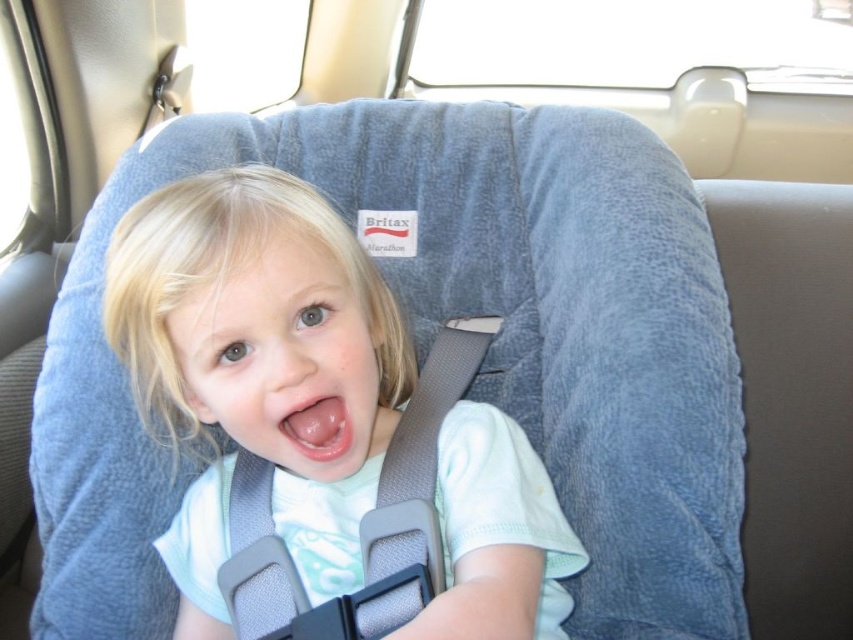
Does matte gray car seat at center appear over pink glossy tongue at center?

Result: No, matte gray car seat at center is not above pink glossy tongue at center.

Locate an element on the screen. Image resolution: width=853 pixels, height=640 pixels. matte gray car seat at center is located at coordinates (263, 340).

Is point (178, 401) less distant than point (315, 406)?

No, (178, 401) is further to viewer.

Find the location of a particular element. matte gray car seat at center is located at coordinates (263, 340).